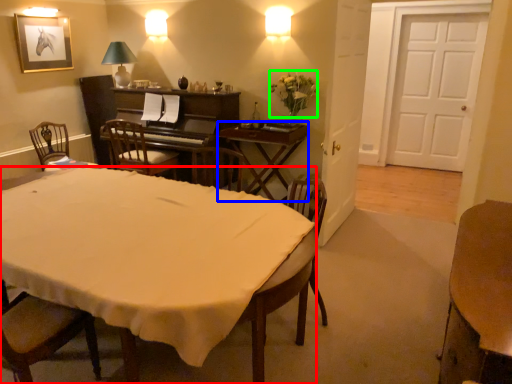
Question: Which is farther away from desk (highlighted by a red box)? table (highlighted by a blue box) or flower (highlighted by a green box)?

Choices:
 (A) table
 (B) flower

Answer: (B)